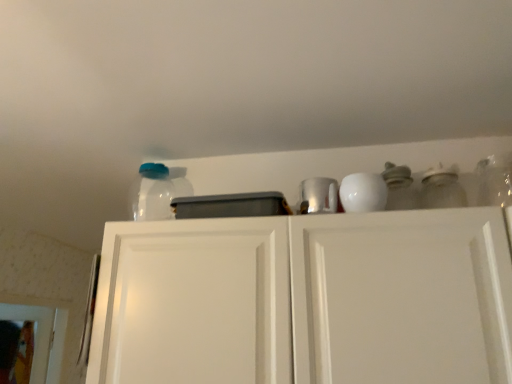
Question: Is point (x=309, y=185) closer or farther from the camera than point (x=302, y=278)?

Choices:
 (A) closer
 (B) farther

Answer: (B)

Question: Is shiny metallic cup at upper center wider or thinner than white matte cabinet doors at upper center?

Choices:
 (A) wide
 (B) thin

Answer: (B)

Question: Estimate the real-world distances between objects in this image. Which object is farther from the shiny metallic cup at upper center?

Choices:
 (A) white matte cabinet doors at upper center
 (B) clear glass jar at upper right, which ranks as the second glass jar in left-to-right order
 (C) transparent plastic jar at upper left, the 1th glass jar positioned from the left

Answer: (C)

Question: Which is farther from the white matte cabinet doors at upper center?

Choices:
 (A) clear glass jar at upper right, which ranks as the first glass jar in front-to-back order
 (B) shiny metallic cup at upper center
 (C) transparent plastic jar at upper left, which appears as the 1th glass jar when viewed from the back

Answer: (A)